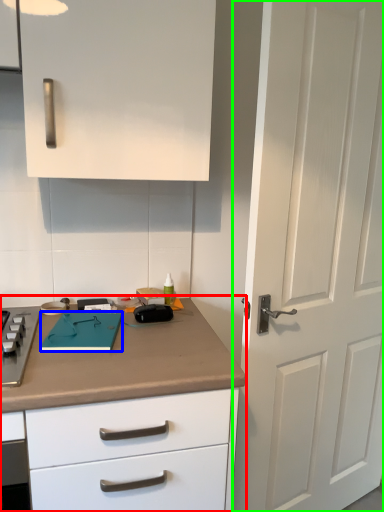
Question: Which object is the farthest from countertop (highlighted by a red box)? Choose among these: notepad (highlighted by a blue box) or door (highlighted by a green box).

Choices:
 (A) notepad
 (B) door

Answer: (B)